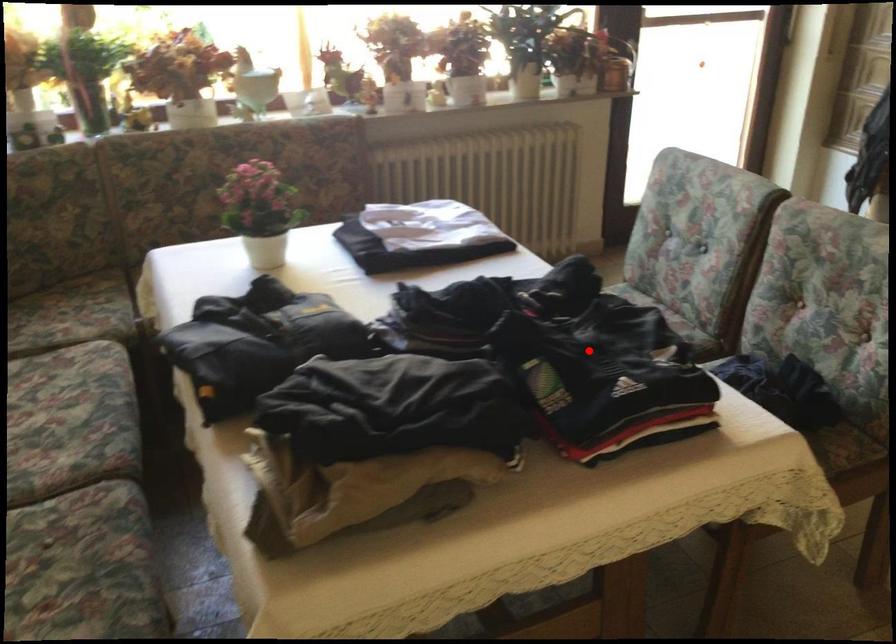
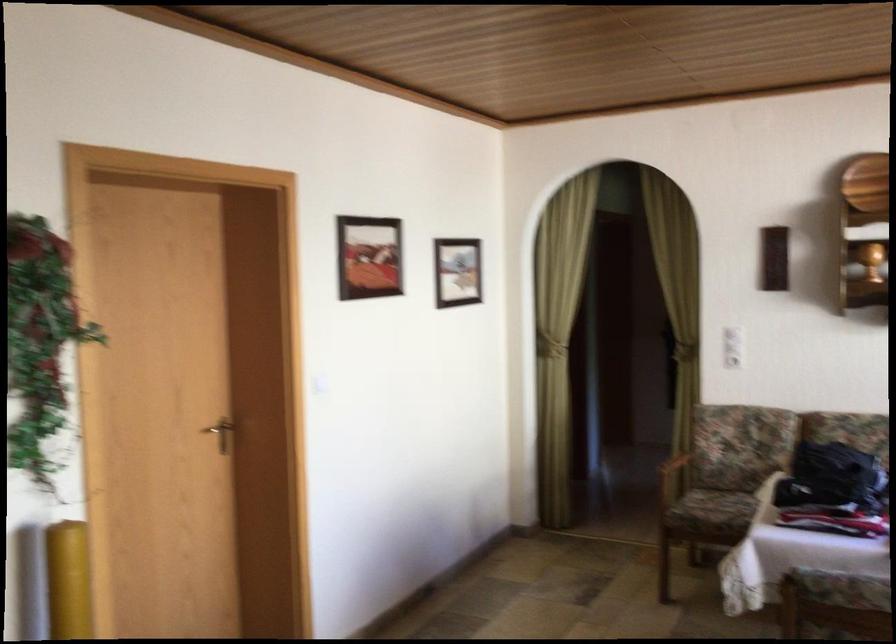
Where in the second image is the point corresponding to the highlighted location from the first image?

(831, 478)